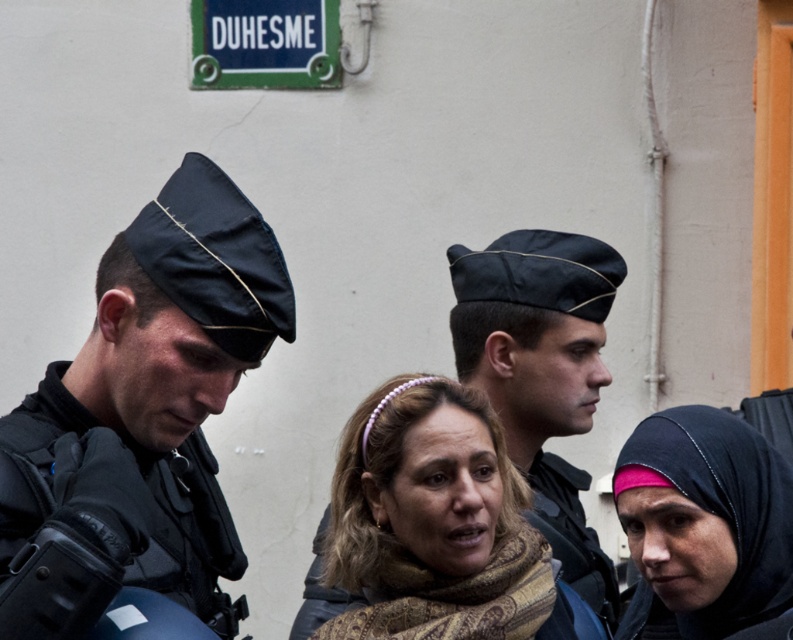
Who is more distant from viewer, (491, 384) or (318, 42)?

Point (318, 42)

Which is below, matte black beret at center or green metal street sign at upper center?

matte black beret at center

Does point (558, 237) come closer to viewer compared to point (232, 36)?

Yes, point (558, 237) is closer to viewer.

Locate an element on the screen. Image resolution: width=793 pixels, height=640 pixels. matte black beret at center is located at coordinates (542, 372).

Consider the image. Is brown textured scarf at center taller than matte black beret at center?

Incorrect, brown textured scarf at center's height is not larger of matte black beret at center's.

In the scene shown: Does brown textured scarf at center lie in front of matte black beret at center?

That is True.

In the scene shown: Who is more forward, (x=491, y=538) or (x=511, y=419)?

Positioned in front is point (x=491, y=538).

Where is `brown textured scarf at center`? The width and height of the screenshot is (793, 640). brown textured scarf at center is located at coordinates (435, 524).

Is brown textured scarf at center below pink satin hijab at center?

No, brown textured scarf at center is not below pink satin hijab at center.

What do you see at coordinates (435, 524) in the screenshot? I see `brown textured scarf at center` at bounding box center [435, 524].

Between point (465, 456) and point (619, 481), which one is positioned behind?

Positioned behind is point (465, 456).

Locate an element on the screen. brown textured scarf at center is located at coordinates (435, 524).